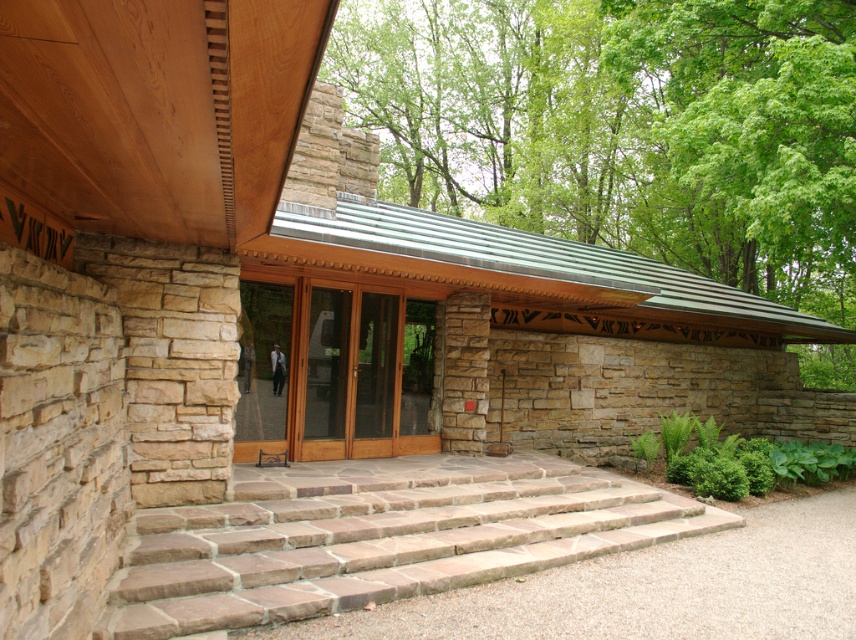
Between point (553, 525) and point (391, 388), which one is positioned behind?

The point (391, 388) is more distant.

In the scene shown: Does brown stone stairs at center have a lesser height compared to wooden glass doors at center?

Yes, brown stone stairs at center is shorter than wooden glass doors at center.

Is point (619, 540) behind point (420, 372)?

No, (619, 540) is closer to viewer.

This screenshot has height=640, width=856. I want to click on brown stone stairs at center, so click(377, 538).

Does point (396, 83) come in front of point (180, 620)?

No, it is not.

Which is below, green leafy tree at upper center or brown stone stairs at center?

Positioned lower is brown stone stairs at center.

Is point (764, 168) behind point (270, 579)?

Yes, it is.

This screenshot has height=640, width=856. Find the location of `green leafy tree at upper center`. green leafy tree at upper center is located at coordinates (625, 125).

Is green leafy tree at upper center thinner than wooden glass doors at center?

No.

Which is in front, point (480, 209) or point (394, 440)?

Point (394, 440)

Is point (621, 209) less distant than point (434, 349)?

No.

The width and height of the screenshot is (856, 640). I want to click on green leafy tree at upper center, so click(x=625, y=125).